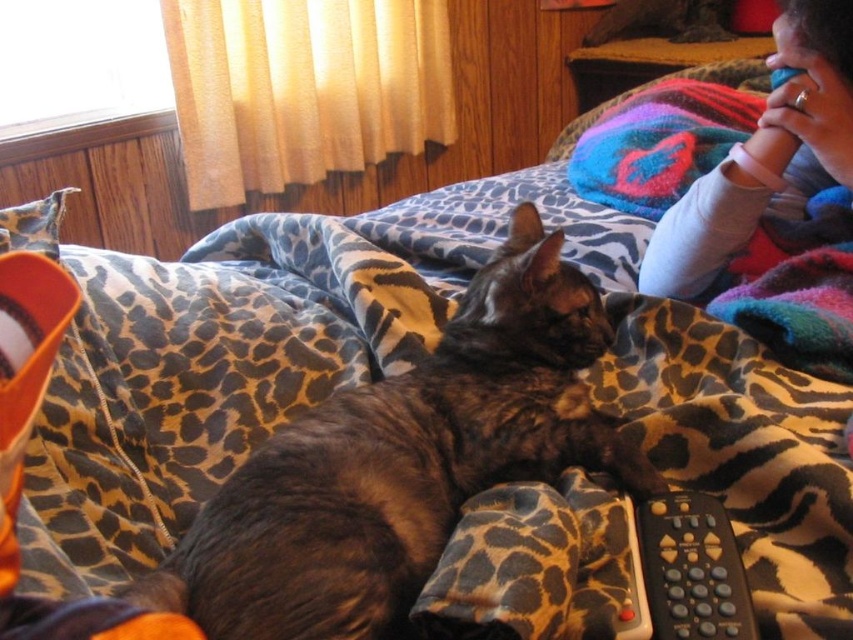
You are a parent entering the room and see the brown fur cat at center and the smooth pink baby rattle at upper right. You want to pick up the rattle but need to know if it is within reach without disturbing the cat. The parent can reach 12 inches. Is the rattle within your reach?

The brown fur cat at center and smooth pink baby rattle at upper right are 12.79 inches apart from each other. Since the parent can only reach 12 inches, the rattle is slightly out of reach and would require moving closer to the cat, potentially disturbing it.

You are a photographer trying to capture the brown fur cat at center and the black plastic remote at lower right in the same frame. Which object will appear bigger in the photo?

The brown fur cat at center will appear bigger in the photo because it is larger in size than the black plastic remote at lower right.

You are a toy designer observing the image of a brown fur cat at center and a smooth pink baby rattle at upper right. Which object is wider?

The brown fur cat at center is wider than the smooth pink baby rattle at upper right.